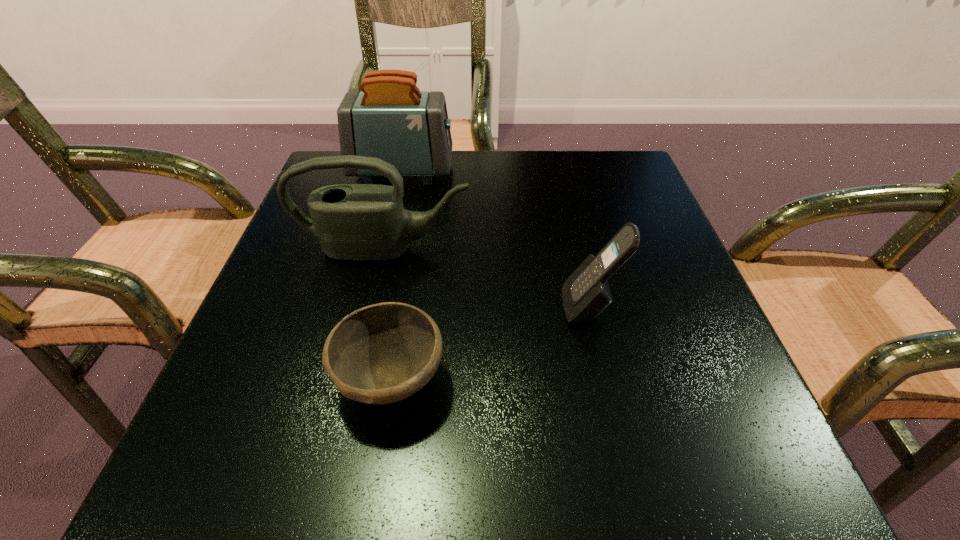
The width and height of the screenshot is (960, 540). Find the location of `free point between the rightmost object and the farthest object`. free point between the rightmost object and the farthest object is located at coordinates (496, 239).

Locate an element on the screen. vacant point located between the shortest object and the farthest object is located at coordinates (396, 276).

This screenshot has height=540, width=960. In order to click on vacant area between the rightmost object and the toaster in this screenshot , I will do `click(496, 239)`.

Identify the location of vacant area between the cellular telephone and the watering can. (487, 278).

The height and width of the screenshot is (540, 960). What are the coordinates of `object that is the third closest to the shortest object` in the screenshot? It's located at (391, 119).

Find the location of a particular element. The width and height of the screenshot is (960, 540). object that is the closest to the bowl is located at coordinates (362, 222).

Find the location of a particular element. This screenshot has width=960, height=540. free region that satisfies the following two spatial constraints: 1. on the front-facing side of the toaster; 2. on the spout of the third nearest object is located at coordinates (385, 248).

Find the location of a particular element. This screenshot has height=540, width=960. vacant space that satisfies the following two spatial constraints: 1. on the front-facing side of the farthest object; 2. on the right side of the nearest object is located at coordinates (353, 381).

Where is `vacant space that satisfies the following two spatial constraints: 1. on the spout of the bowl; 2. on the right side of the watering can`? vacant space that satisfies the following two spatial constraints: 1. on the spout of the bowl; 2. on the right side of the watering can is located at coordinates (353, 381).

Where is `vacant space that satisfies the following two spatial constraints: 1. on the front-facing side of the farthest object; 2. on the right side of the nearest object`? Image resolution: width=960 pixels, height=540 pixels. vacant space that satisfies the following two spatial constraints: 1. on the front-facing side of the farthest object; 2. on the right side of the nearest object is located at coordinates (353, 381).